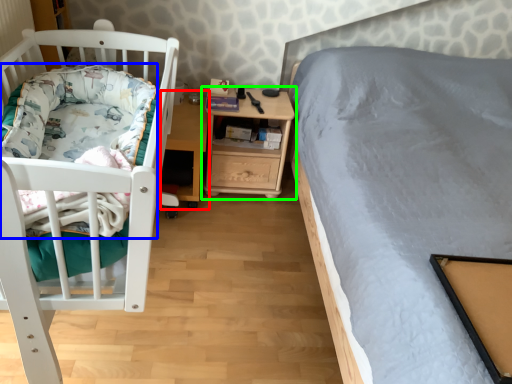
Question: Which is farther away from table (highlighted by a red box)? blanket (highlighted by a blue box) or nightstand (highlighted by a green box)?

Choices:
 (A) blanket
 (B) nightstand

Answer: (A)